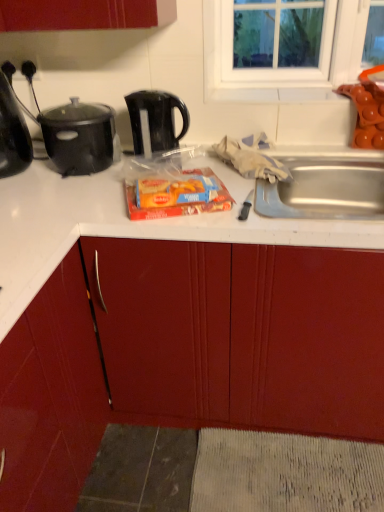
Locate an element on the screen. This screenshot has width=384, height=512. free point to the right of shiny black kettle at left is located at coordinates (49, 182).